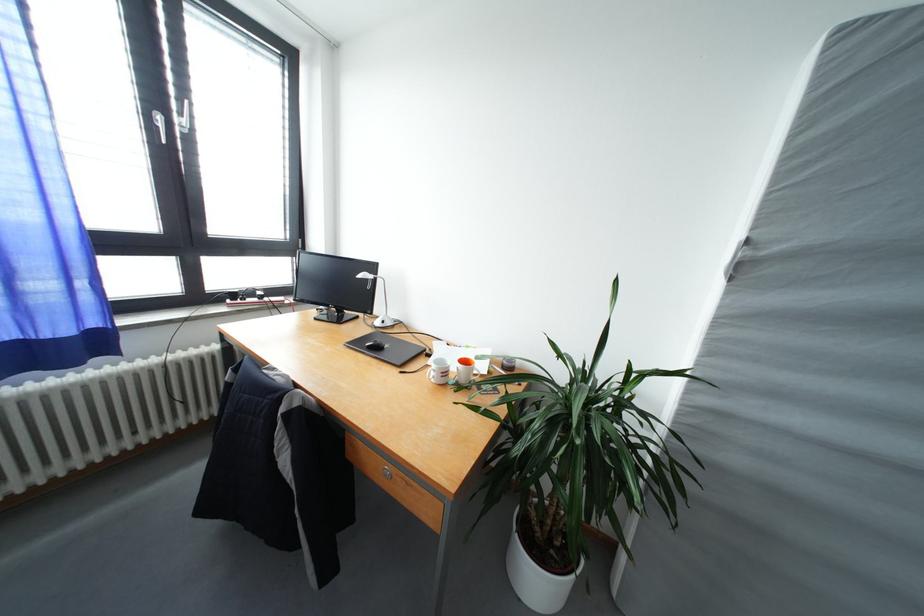
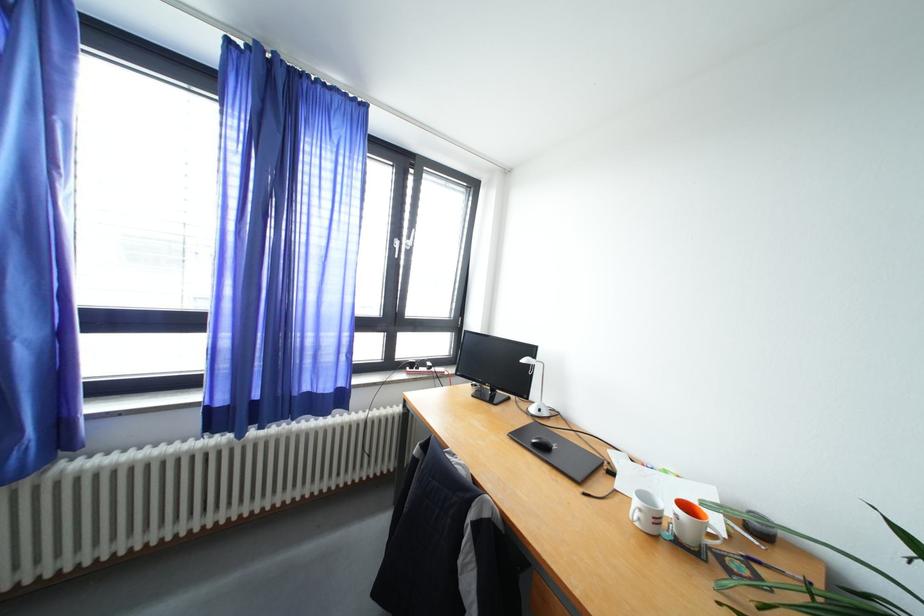
Question: The camera is either moving clockwise (left) or counter-clockwise (right) around the object. The first image is from the beginning of the video and the second image is from the end. Is the camera moving left or right when shooting the video?

Choices:
 (A) Left
 (B) Right

Answer: (B)